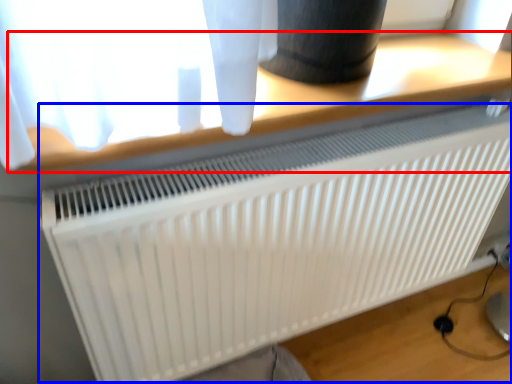
Question: Which point is further to the camera, table (highlighted by a red box) or radiator (highlighted by a blue box)?

Choices:
 (A) table
 (B) radiator

Answer: (B)